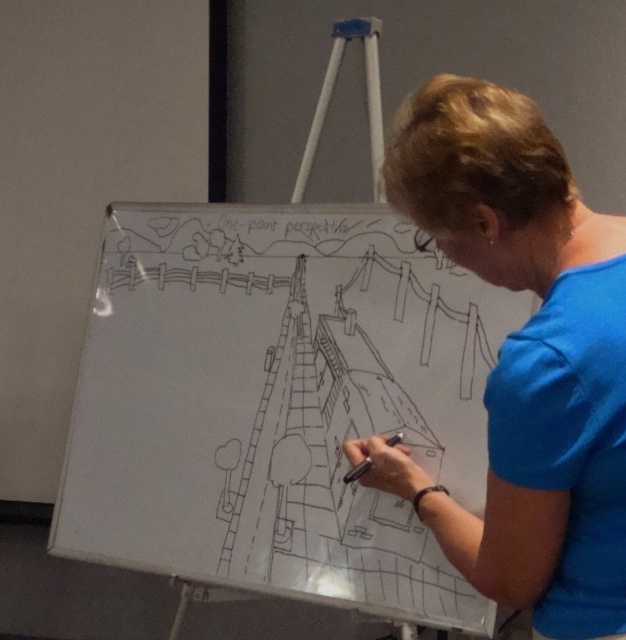
Measure the distance between point [269,541] and camera.

The distance of point [269,541] from camera is 6.81 feet.

Can you confirm if white paperboard at center is smaller than black matte pen at center?

Actually, white paperboard at center might be larger than black matte pen at center.

The height and width of the screenshot is (640, 626). Describe the element at coordinates (279, 403) in the screenshot. I see `white paperboard at center` at that location.

The width and height of the screenshot is (626, 640). I want to click on white paperboard at center, so click(x=279, y=403).

From the picture: Who is shorter, white paperboard at center or black line drawing eiffel tower at center?

black line drawing eiffel tower at center

Does white paperboard at center have a greater height compared to black line drawing eiffel tower at center?

Yes.

Image resolution: width=626 pixels, height=640 pixels. Identify the location of white paperboard at center. [279, 403].

Locate an element on the screen. This screenshot has width=626, height=640. white paperboard at center is located at coordinates (279, 403).

Which is more to the left, blue fabric shirt at center or black matte pen at center?

Positioned to the left is black matte pen at center.

Consider the image. Which is above, blue fabric shirt at center or black matte pen at center?

Positioned higher is blue fabric shirt at center.

The image size is (626, 640). Identify the location of blue fabric shirt at center. (523, 358).

Locate an element on the screen. This screenshot has width=626, height=640. blue fabric shirt at center is located at coordinates (523, 358).